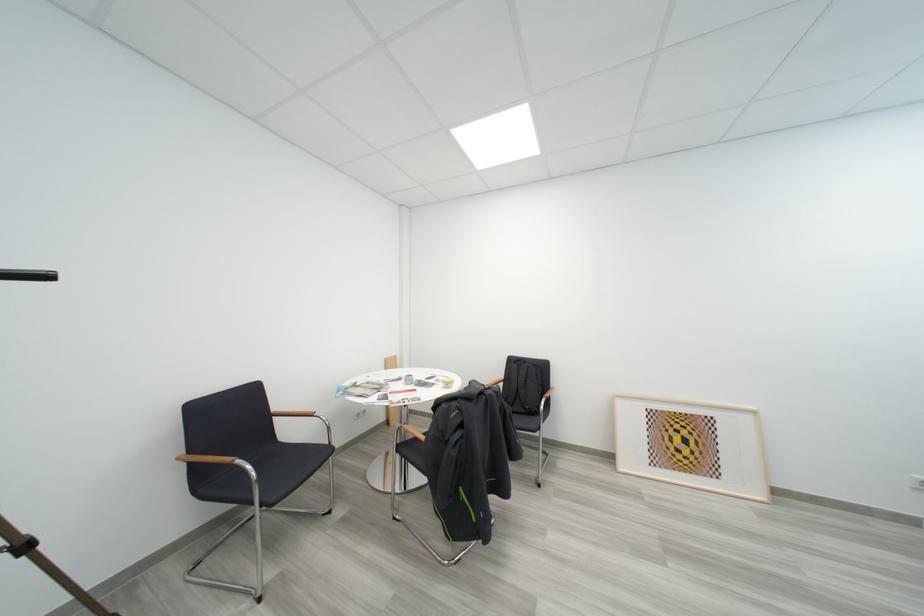
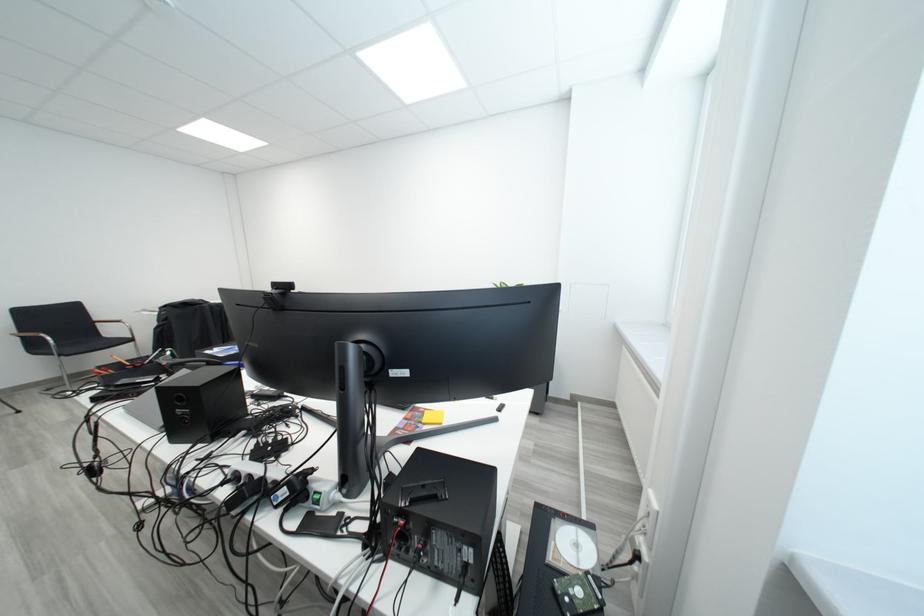
The point at (261,477) is marked in the first image. Where is the corresponding point in the second image?

(62, 344)